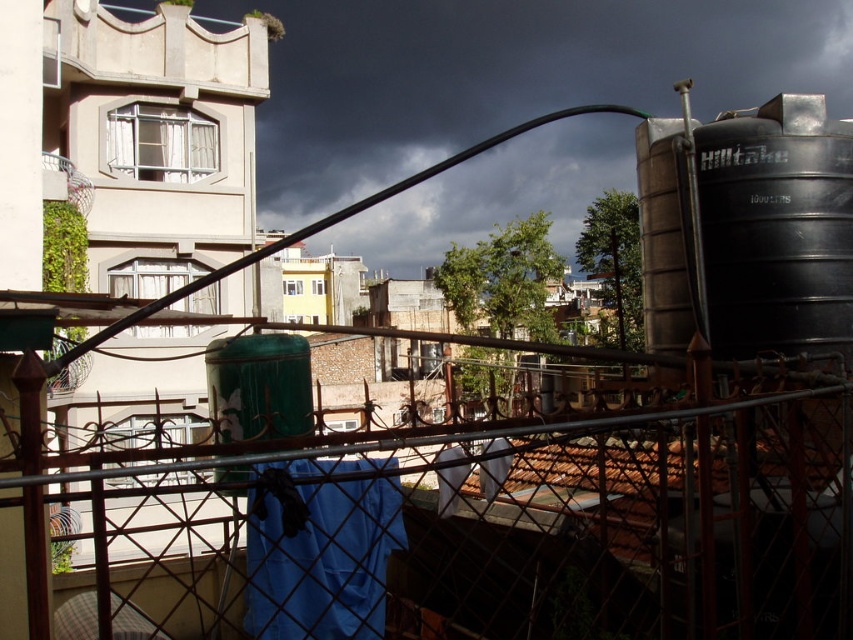
Question: Among these points, which one is farthest from the camera?

Choices:
 (A) (247, 515)
 (B) (708, 266)

Answer: (B)

Question: Can you confirm if rusty metal fence at center is smaller than black matte water tank at right?

Choices:
 (A) yes
 (B) no

Answer: (B)

Question: Can you confirm if rusty metal fence at center is bigger than black matte water tank at right?

Choices:
 (A) yes
 (B) no

Answer: (A)

Question: In this image, where is rusty metal fence at center located relative to black matte water tank at right?

Choices:
 (A) right
 (B) left

Answer: (B)